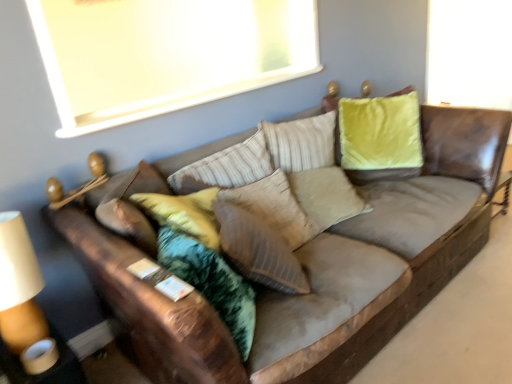
Question: Is suede textured pillow at center positioned with its back to white matte window screen at upper center?

Choices:
 (A) no
 (B) yes

Answer: (A)

Question: Can you confirm if suede textured pillow at center is bigger than white matte window screen at upper center?

Choices:
 (A) no
 (B) yes

Answer: (A)

Question: Does suede textured pillow at center have a lesser height compared to white matte window screen at upper center?

Choices:
 (A) yes
 (B) no

Answer: (A)

Question: Is suede textured pillow at center taller than white matte window screen at upper center?

Choices:
 (A) yes
 (B) no

Answer: (B)

Question: Does suede textured pillow at center appear on the left side of white matte window screen at upper center?

Choices:
 (A) no
 (B) yes

Answer: (A)

Question: Is brown leather couch at center inside or outside of white matte window screen at upper center?

Choices:
 (A) inside
 (B) outside

Answer: (B)

Question: Is point (463, 152) positioned closer to the camera than point (60, 33)?

Choices:
 (A) closer
 (B) farther

Answer: (A)

Question: From the image's perspective, relative to white matte window screen at upper center, is brown leather couch at center above or below?

Choices:
 (A) above
 (B) below

Answer: (B)

Question: Is brown leather couch at center to the left or to the right of white matte window screen at upper center in the image?

Choices:
 (A) left
 (B) right

Answer: (B)

Question: Is point (236, 238) positioned closer to the camera than point (168, 109)?

Choices:
 (A) closer
 (B) farther

Answer: (A)

Question: Based on their positions, is suede textured pillow at center located to the left or right of white matte window screen at upper center?

Choices:
 (A) right
 (B) left

Answer: (A)

Question: In terms of width, does suede textured pillow at center look wider or thinner when compared to white matte window screen at upper center?

Choices:
 (A) wide
 (B) thin

Answer: (A)

Question: Choose the correct answer: Is suede textured pillow at center inside white matte window screen at upper center or outside it?

Choices:
 (A) outside
 (B) inside

Answer: (A)

Question: Considering their positions, is brown leather couch at center located in front of or behind suede textured pillow at center?

Choices:
 (A) front
 (B) behind

Answer: (A)

Question: In terms of width, does brown leather couch at center look wider or thinner when compared to suede textured pillow at center?

Choices:
 (A) thin
 (B) wide

Answer: (B)